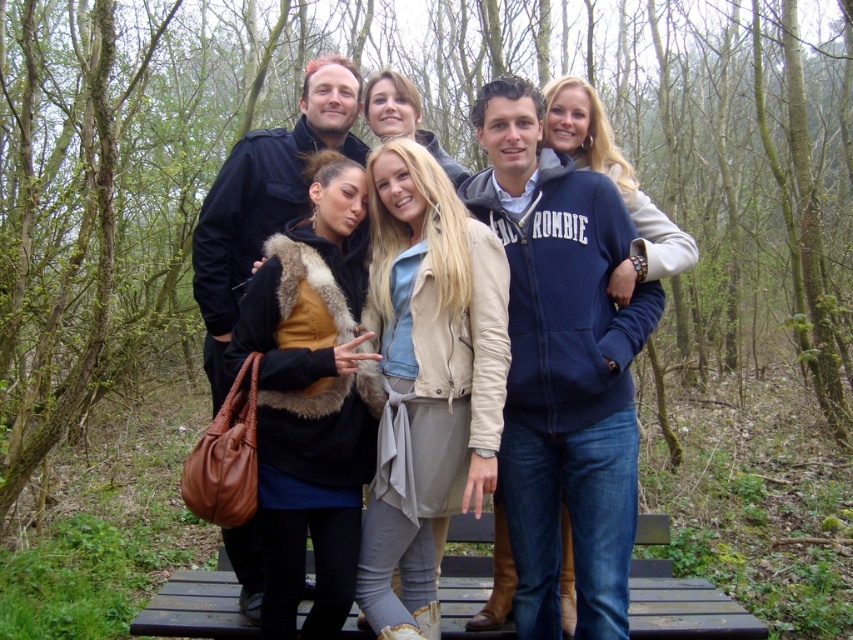
You are an artist trying to sketch this scene. You notice the matte black jacket at center and the black wood bench at center. Which object should you draw first if you want to follow the rule of starting with the wider object?

The matte black jacket at center should be drawn first because its width is larger than the black wood bench at center, so it fits the rule of starting with the wider object.

You are standing in front of the group on the wooden bench. Which object is closer to you between the matte black jacket at center and the black wood bench at center?

The matte black jacket at center is closer to you because the black wood bench at center is behind it.

You are standing in front of the group on the wooden bench. Where exactly is the matte black jacket at center located in terms of coordinates?

The matte black jacket at center is located at point coordinates of 0.291 on the x axis and 0.338 on the y axis.